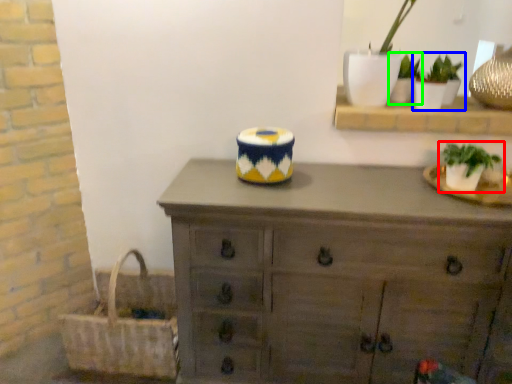
Question: Which object is positioned farthest from houseplant (highlighted by a red box)? Select from houseplant (highlighted by a blue box) and houseplant (highlighted by a green box).

Choices:
 (A) houseplant
 (B) houseplant

Answer: (B)